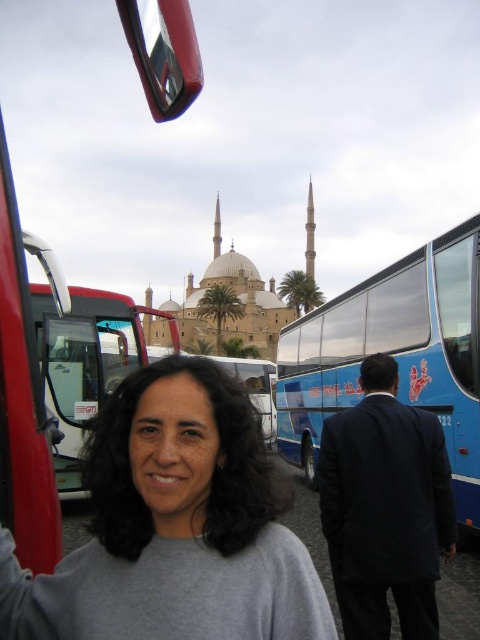
You are standing at the point with coordinates point [45,289] and want to take a photo of the point [180,360]. Is there any obstruction between you and the point you want to photograph?

Point [180,360] is in front of point [45,289], so there is no obstruction between you and the point you want to photograph.

You are a photographer standing in front of the historic building with two minarets. You want to take a photo of the blue glossy bus at right and the metallic silver bus at left. Which bus is positioned lower in the frame?

The blue glossy bus at right is located below the metallic silver bus at left, so it is positioned lower in the frame.